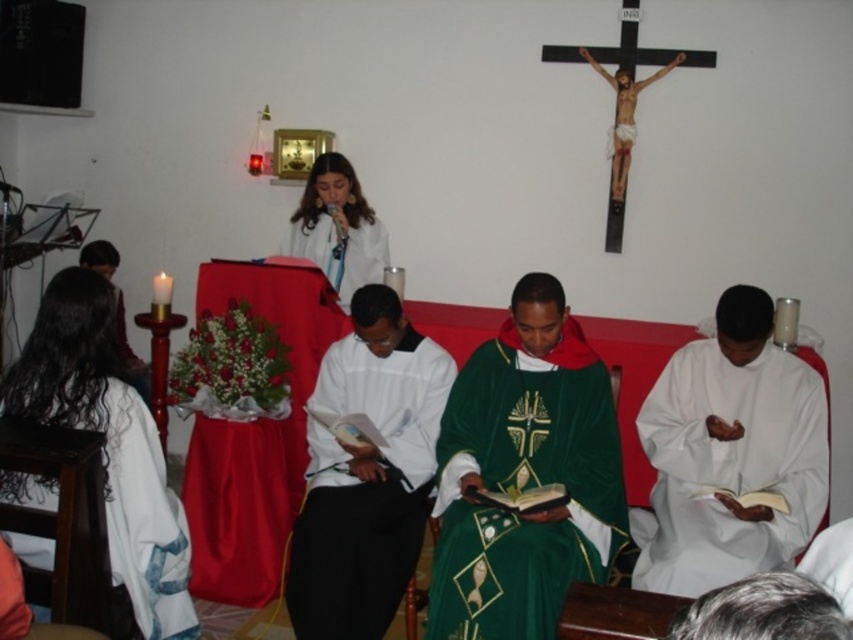
Question: Which point appears farthest from the camera in this image?

Choices:
 (A) (498, 337)
 (B) (433, 385)
 (C) (611, 170)

Answer: (C)

Question: Which point is closer to the camera?

Choices:
 (A) (352, 488)
 (B) (538, 413)
 (C) (619, 72)
 (D) (120, 429)

Answer: (D)

Question: Is white matte robe at lower right thinner than white matte robe at center?

Choices:
 (A) no
 (B) yes

Answer: (A)

Question: Considering the relative positions of green velvet robe at center and white matte robe at center in the image provided, where is green velvet robe at center located with respect to white matte robe at center?

Choices:
 (A) right
 (B) left

Answer: (A)

Question: Among these points, which one is nearest to the camera?

Choices:
 (A) (660, 476)
 (B) (351, 285)

Answer: (A)

Question: Is white cloth at left bigger than white matte robe at upper center?

Choices:
 (A) no
 (B) yes

Answer: (B)